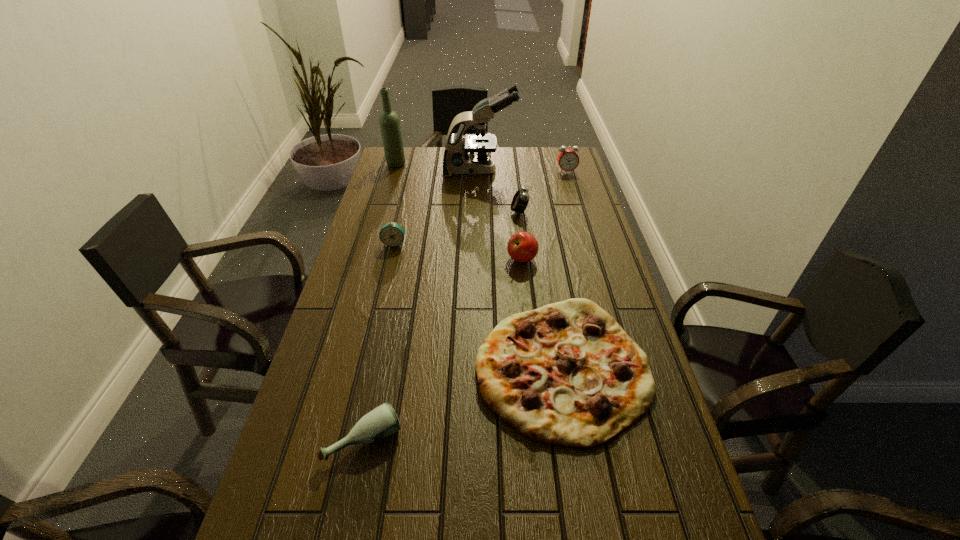
The width and height of the screenshot is (960, 540). In the image, there is a desktop. What are the coordinates of `free region at the left edge` in the screenshot? It's located at (360, 290).

Identify the location of vacant area at the right edge of the desktop. (595, 269).

The width and height of the screenshot is (960, 540). Find the location of `vacant area at the far left corner`. vacant area at the far left corner is located at coordinates (407, 158).

Find the location of a particular element. free space at the far right corner is located at coordinates (549, 148).

What are the coordinates of `empty location between the pizza and the shortest alarm clock` in the screenshot? It's located at (478, 306).

This screenshot has width=960, height=540. Find the location of `blank region between the nearest alarm clock and the second farthest alarm clock`. blank region between the nearest alarm clock and the second farthest alarm clock is located at coordinates (457, 228).

I want to click on vacant area that lies between the fifth nearest object and the pizza, so click(x=540, y=290).

The height and width of the screenshot is (540, 960). In order to click on free point between the wine bottle and the fifth farthest object in this screenshot , I will do `click(395, 204)`.

Locate an element on the screen. vacant area between the fifth nearest object and the seventh tallest object is located at coordinates (442, 326).

Identify the location of vacant area that lies between the shortest object and the microscope. The image size is (960, 540). (521, 269).